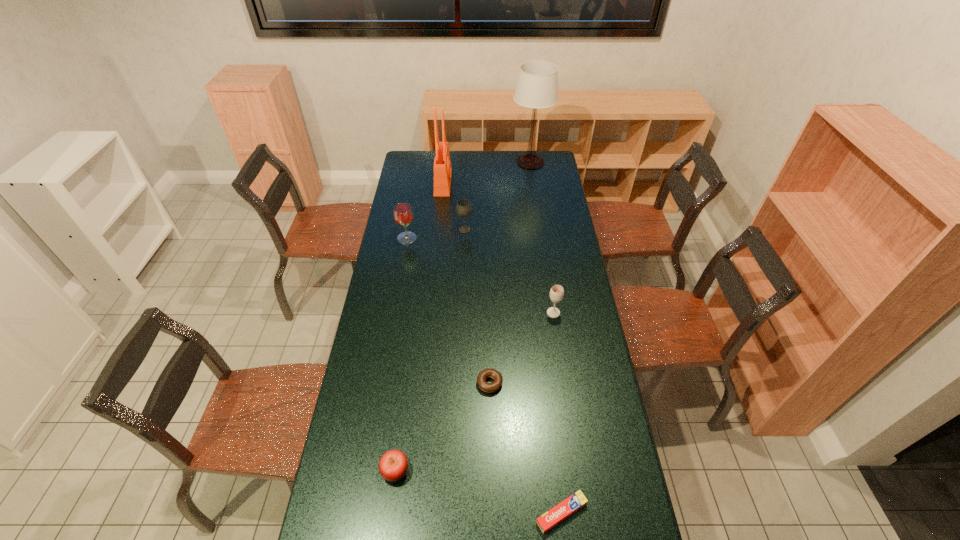
At what (x,y) coordinates should I click in order to perform the action: click on vacant space situated 0.290m on the right of the doughnut. Please return your answer as a coordinate pair (x, y). The width and height of the screenshot is (960, 540). Looking at the image, I should click on (583, 383).

Image resolution: width=960 pixels, height=540 pixels. What are the coordinates of `free space located 0.370m on the back of the shortest object` in the screenshot? It's located at (546, 384).

Where is `table lamp positioned at the far edge`? Image resolution: width=960 pixels, height=540 pixels. table lamp positioned at the far edge is located at coordinates (537, 84).

In order to click on tote bag that is at the far edge in this screenshot , I will do `click(442, 169)`.

Where is `wineglass situated at the left edge`? The width and height of the screenshot is (960, 540). wineglass situated at the left edge is located at coordinates (403, 215).

Where is `apple present at the left edge`? apple present at the left edge is located at coordinates (393, 465).

Find the location of a particular element. The height and width of the screenshot is (540, 960). table lamp positioned at the right edge is located at coordinates (537, 84).

Where is `wineglass present at the right edge`? wineglass present at the right edge is located at coordinates (557, 292).

Find the location of a particular element. The width and height of the screenshot is (960, 540). toothpaste that is at the right edge is located at coordinates (551, 518).

The image size is (960, 540). What are the coordinates of `object located in the far right corner section of the desktop` in the screenshot? It's located at (537, 84).